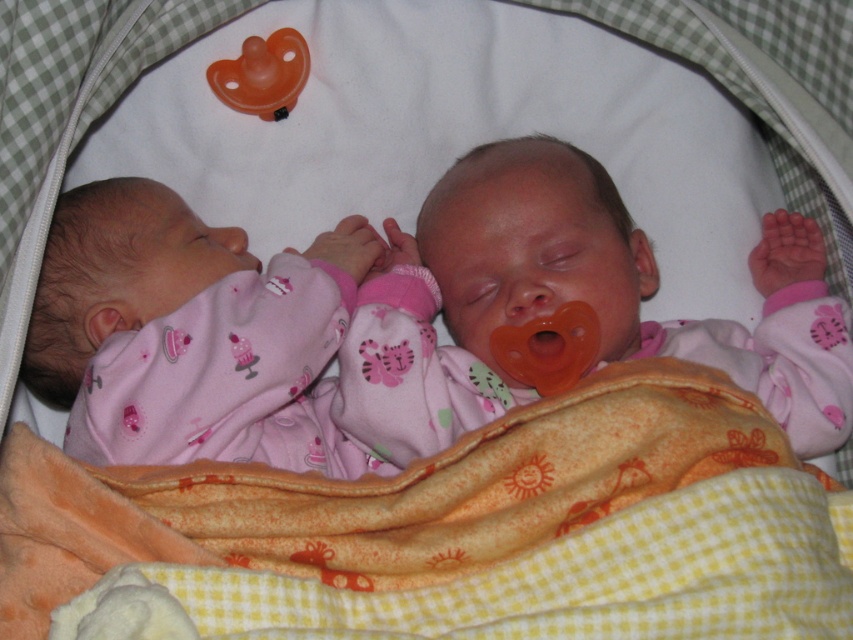
Is the position of yellow fleece blanket at center more distant than that of orange rubber pacifier at upper left?

No, it is not.

In the scene shown: Is the position of yellow fleece blanket at center less distant than that of orange rubber pacifier at upper left?

Yes, yellow fleece blanket at center is closer to the viewer.

Who is more distant from viewer, (706, 388) or (241, 64)?

The point (241, 64) is behind.

Locate an element on the screen. yellow fleece blanket at center is located at coordinates (445, 516).

Who is taller, matte orange pacifier at center or orange rubber pacifier at upper left?

matte orange pacifier at center

Is matte orange pacifier at center shorter than orange rubber pacifier at upper left?

No.

I want to click on matte orange pacifier at center, so click(x=624, y=280).

Does matte orange pacifier at center have a smaller size compared to orange rubber pacifier at center?

Actually, matte orange pacifier at center might be larger than orange rubber pacifier at center.

Is point (741, 384) closer to camera compared to point (509, 349)?

That is True.

Image resolution: width=853 pixels, height=640 pixels. What do you see at coordinates (624, 280) in the screenshot?
I see `matte orange pacifier at center` at bounding box center [624, 280].

Locate an element on the screen. matte orange pacifier at center is located at coordinates (624, 280).